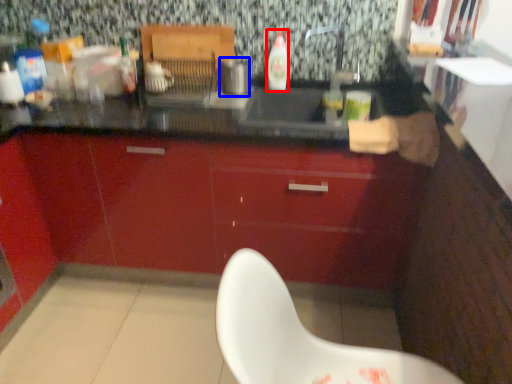
Question: Which of the following is the farthest to the observer, bottle (highlighted by a red box) or appliance (highlighted by a blue box)?

Choices:
 (A) bottle
 (B) appliance

Answer: (A)